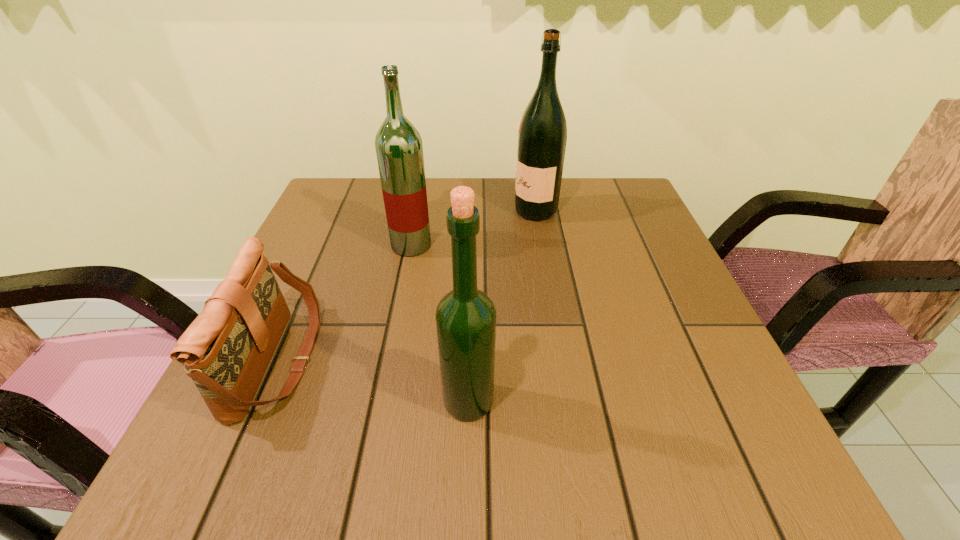
This screenshot has height=540, width=960. What are the coordinates of `the rightmost object` in the screenshot? It's located at (542, 136).

The image size is (960, 540). Find the location of `the farthest liquor`. the farthest liquor is located at coordinates (542, 136).

The image size is (960, 540). I want to click on the leftmost liquor, so click(x=398, y=144).

Where is `the second farthest object`? The height and width of the screenshot is (540, 960). the second farthest object is located at coordinates (398, 144).

You are a GUI agent. You are given a task and a screenshot of the screen. Output one action in this format:
    pyautogui.click(x=<x>, y=<y>)
    Task: Click on the third object from left to right
    
    Given the screenshot: What is the action you would take?
    pyautogui.click(x=465, y=317)

Locate an element on the screen. the nearest liquor is located at coordinates (465, 317).

This screenshot has width=960, height=540. Identify the location of the shortest object. (226, 350).

The image size is (960, 540). Identify the location of the leftmost object. (226, 350).

Where is `blank space located 0.400m on the front-facing side of the rightmost object`? Image resolution: width=960 pixels, height=540 pixels. blank space located 0.400m on the front-facing side of the rightmost object is located at coordinates (358, 211).

The image size is (960, 540). In order to click on vacant space located 0.280m on the front-facing side of the rightmost object in this screenshot , I will do `click(405, 211)`.